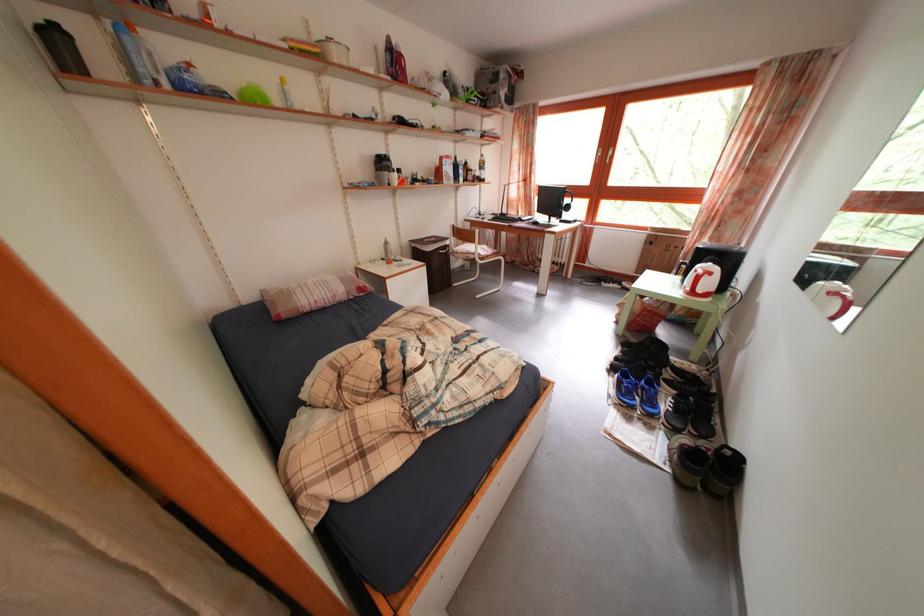
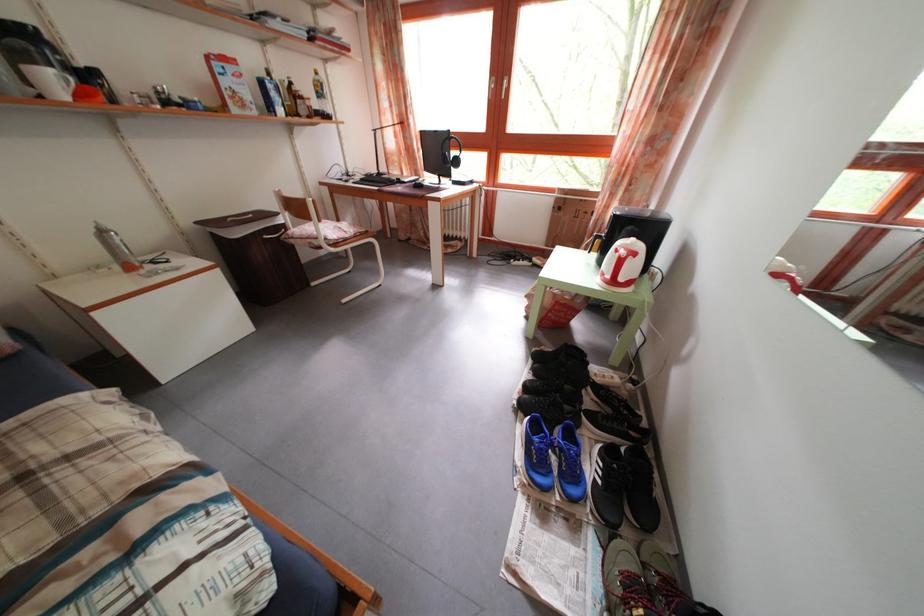
Where in the second image is the point corresponding to point (560, 207) from the first image?

(446, 160)